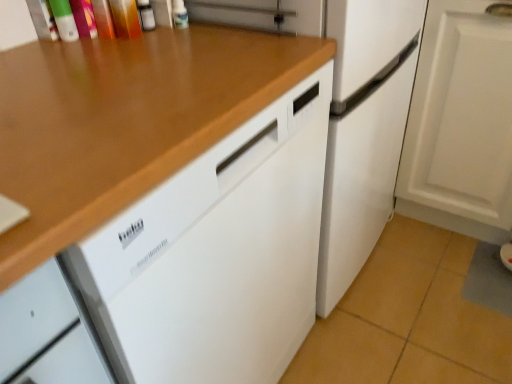
Question: Should I look upward or downward to see wooden at upper left?

Choices:
 (A) down
 (B) up

Answer: (A)

Question: From a real-world perspective, is wooden at upper left located higher than white matte refrigerator at center?

Choices:
 (A) yes
 (B) no

Answer: (B)

Question: Is wooden at upper left positioned with its back to white matte refrigerator at center?

Choices:
 (A) yes
 (B) no

Answer: (B)

Question: Considering the relative sizes of wooden at upper left and white matte refrigerator at center in the image provided, is wooden at upper left taller than white matte refrigerator at center?

Choices:
 (A) yes
 (B) no

Answer: (B)

Question: From the image's perspective, is wooden at upper left under white matte refrigerator at center?

Choices:
 (A) no
 (B) yes

Answer: (B)

Question: Is wooden at upper left behind white matte refrigerator at center?

Choices:
 (A) no
 (B) yes

Answer: (A)

Question: Does wooden at upper left touch white matte refrigerator at center?

Choices:
 (A) yes
 (B) no

Answer: (B)

Question: Is white matte refrigerator at center thinner than white matte cabinet at lower right?

Choices:
 (A) yes
 (B) no

Answer: (B)

Question: Is white matte refrigerator at center positioned with its back to white matte cabinet at lower right?

Choices:
 (A) yes
 (B) no

Answer: (B)

Question: Does white matte refrigerator at center appear on the left side of white matte cabinet at lower right?

Choices:
 (A) no
 (B) yes

Answer: (B)

Question: Is the depth of white matte refrigerator at center greater than that of white matte cabinet at lower right?

Choices:
 (A) yes
 (B) no

Answer: (B)

Question: From a real-world perspective, is white matte refrigerator at center under white matte cabinet at lower right?

Choices:
 (A) yes
 (B) no

Answer: (B)

Question: Is white matte refrigerator at center outside of white matte cabinet at lower right?

Choices:
 (A) no
 (B) yes

Answer: (B)

Question: Is white matte cabinet at lower right in contact with white matte refrigerator at center?

Choices:
 (A) yes
 (B) no

Answer: (B)